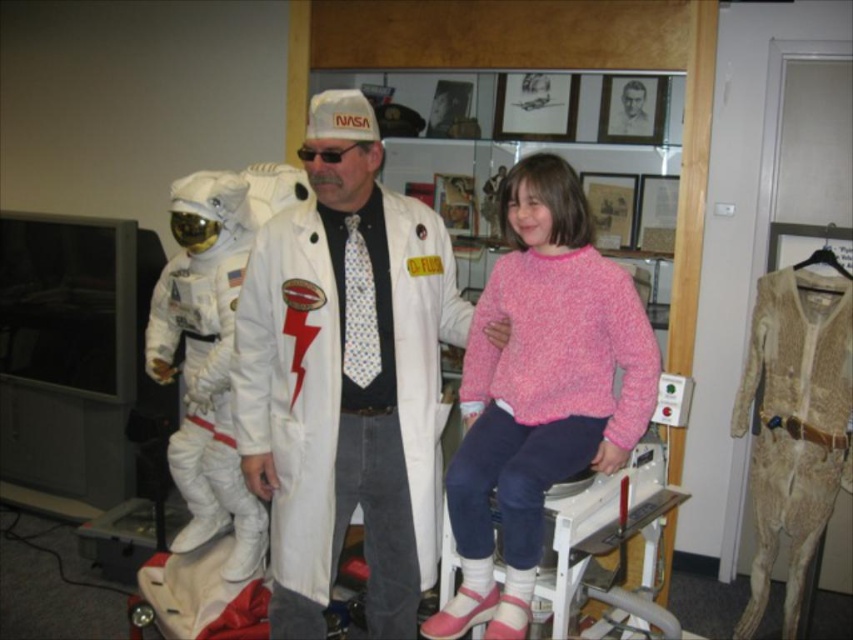
Question: Where is white matte lab coat at center located in relation to white fabric astronaut suit at left in the image?

Choices:
 (A) right
 (B) left

Answer: (A)

Question: Does white matte lab coat at center come behind pink fuzzy sweater at center?

Choices:
 (A) yes
 (B) no

Answer: (A)

Question: Which point appears closest to the camera in this image?

Choices:
 (A) (215, 458)
 (B) (479, 435)
 (C) (428, 588)

Answer: (B)

Question: Which object is farther from the camera taking this photo?

Choices:
 (A) white matte lab coat at center
 (B) pink fuzzy sweater at center
 (C) white fabric astronaut suit at left

Answer: (C)

Question: Which point appears farthest from the camera in this image?

Choices:
 (A) (547, 323)
 (B) (329, 97)

Answer: (A)

Question: From the image, what is the correct spatial relationship of pink fuzzy sweater at center in relation to white fabric astronaut suit at left?

Choices:
 (A) right
 (B) left

Answer: (A)